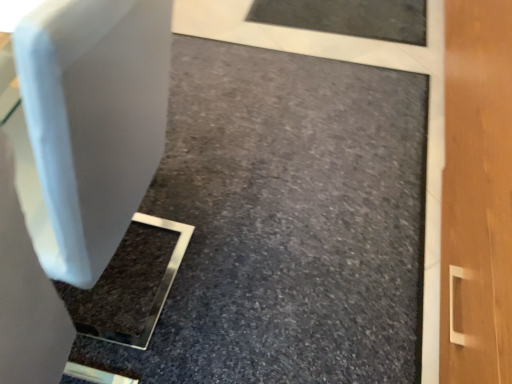
Question: Should I look upward or downward to see white plastic swivel chair at left?

Choices:
 (A) down
 (B) up

Answer: (B)

Question: From a real-world perspective, is white plastic swivel chair at left located higher than matte white concrete at center?

Choices:
 (A) yes
 (B) no

Answer: (A)

Question: Is the depth of white plastic swivel chair at left less than that of matte white concrete at center?

Choices:
 (A) yes
 (B) no

Answer: (A)

Question: Can you confirm if white plastic swivel chair at left is wider than matte white concrete at center?

Choices:
 (A) no
 (B) yes

Answer: (A)

Question: Is white plastic swivel chair at left positioned with its back to matte white concrete at center?

Choices:
 (A) no
 (B) yes

Answer: (A)

Question: Is white plastic swivel chair at left surrounding matte white concrete at center?

Choices:
 (A) no
 (B) yes

Answer: (A)

Question: Considering the relative sizes of white plastic swivel chair at left and matte white concrete at center in the image provided, is white plastic swivel chair at left bigger than matte white concrete at center?

Choices:
 (A) yes
 (B) no

Answer: (A)

Question: Is matte white concrete at center closer to the viewer compared to white plastic swivel chair at left?

Choices:
 (A) yes
 (B) no

Answer: (B)

Question: Considering the relative sizes of matte white concrete at center and white plastic swivel chair at left in the image provided, is matte white concrete at center shorter than white plastic swivel chair at left?

Choices:
 (A) yes
 (B) no

Answer: (A)

Question: Considering the relative sizes of matte white concrete at center and white plastic swivel chair at left in the image provided, is matte white concrete at center thinner than white plastic swivel chair at left?

Choices:
 (A) yes
 (B) no

Answer: (B)

Question: From the image's perspective, is matte white concrete at center located beneath white plastic swivel chair at left?

Choices:
 (A) no
 (B) yes

Answer: (B)

Question: From a real-world perspective, is matte white concrete at center physically below white plastic swivel chair at left?

Choices:
 (A) yes
 (B) no

Answer: (A)

Question: From the image's perspective, is matte white concrete at center on top of white plastic swivel chair at left?

Choices:
 (A) yes
 (B) no

Answer: (B)

Question: From the image's perspective, is matte white concrete at center above or below white plastic swivel chair at left?

Choices:
 (A) below
 (B) above

Answer: (A)